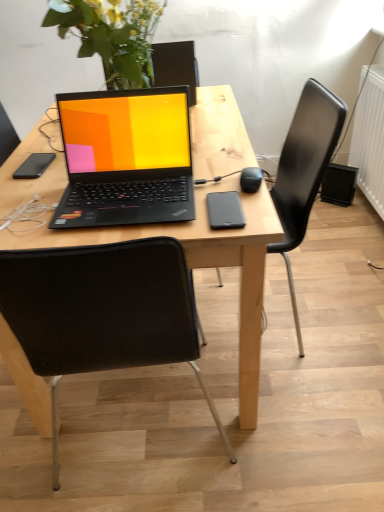
Where is `unoccupied space behind black matte computer mouse at center-right`? unoccupied space behind black matte computer mouse at center-right is located at coordinates (224, 156).